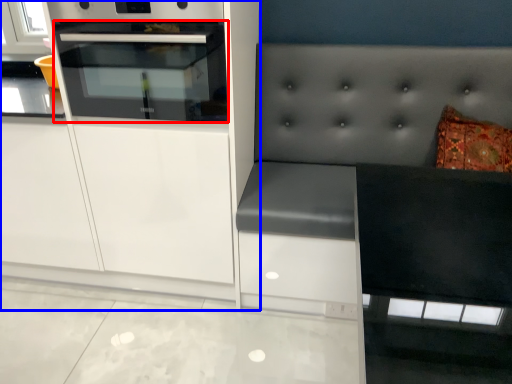
Question: Which object appears closest to the camera in this image, oven (highlighted by a red box) or cabinetry (highlighted by a blue box)?

Choices:
 (A) oven
 (B) cabinetry

Answer: (A)